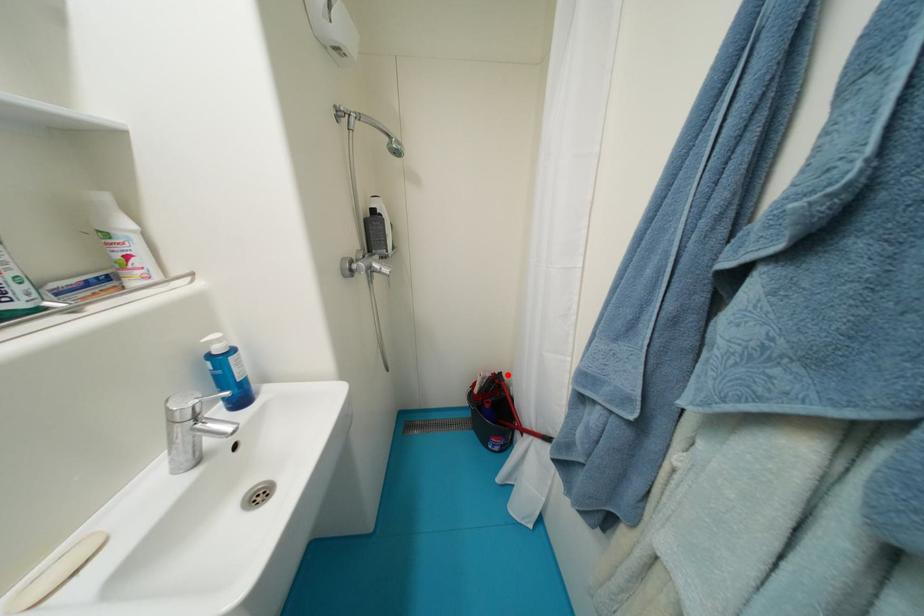
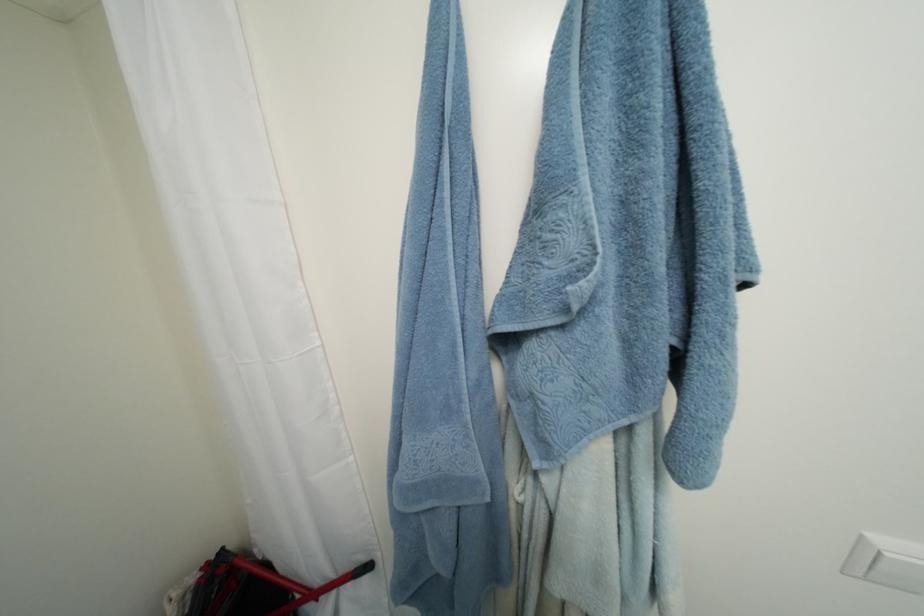
Locate, in the second image, the point that corresponds to the highlighted location in the first image.

(229, 552)